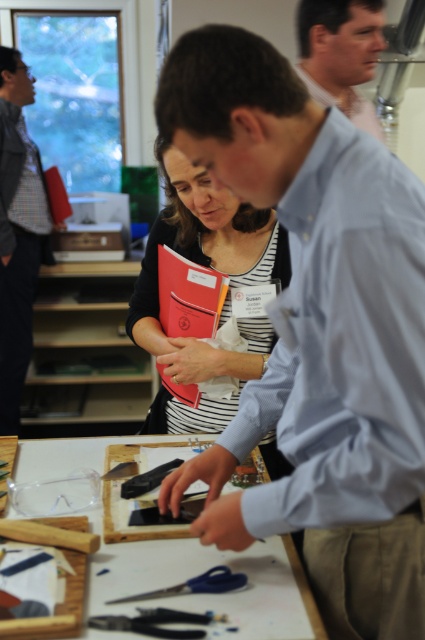
You are an observer looking at the scene. There is a matte blue shirt at upper center and a black plastic tool at center. Which object is positioned to the right of the other?

The matte blue shirt at upper center is to the right of the black plastic tool at center.

You are organizing a craft project and need to place the white paperboard at center and the black plastic tool at center on a shelf. Based on their positions in the image, which object should you place first if you want to replicate the arrangement seen?

The white paperboard at center is below the black plastic tool at center in the image, so you should place the black plastic tool at center first on the shelf to replicate the arrangement.